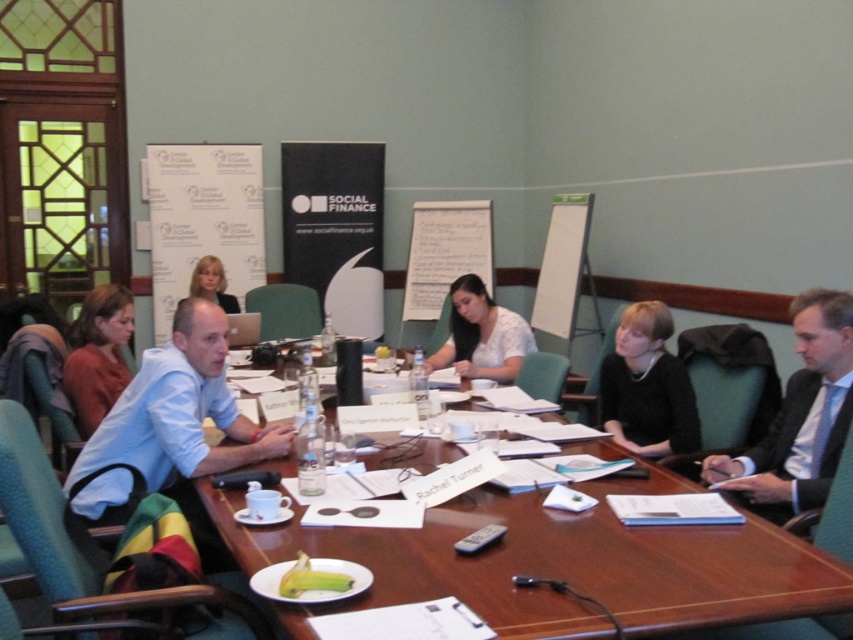
Question: Is light blue suit at right positioned behind matte brown hair at upper left?

Choices:
 (A) no
 (B) yes

Answer: (A)

Question: Is black matte dress at center further to the viewer compared to matte brown hair at upper left?

Choices:
 (A) yes
 (B) no

Answer: (B)

Question: Estimate the real-world distances between objects in this image. Which object is farther from the matte brown hair at upper left?

Choices:
 (A) light blue shirt at center
 (B) wooden table at center
 (C) black matte dress at center

Answer: (C)

Question: Among these objects, which one is farthest from the camera?

Choices:
 (A) white paper at center
 (B) matte brown hair at upper left
 (C) white matte blouse at center

Answer: (A)

Question: Which point is farther to the camera?

Choices:
 (A) (689, 419)
 (B) (184, 483)
 (C) (454, 312)

Answer: (C)

Question: Is light blue shirt at center further to camera compared to white paper at center?

Choices:
 (A) no
 (B) yes

Answer: (A)